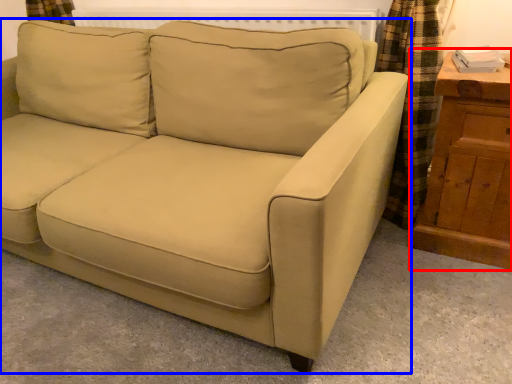
Question: Which point is further to the camera, dresser (highlighted by a red box) or studio couch (highlighted by a blue box)?

Choices:
 (A) dresser
 (B) studio couch

Answer: (A)